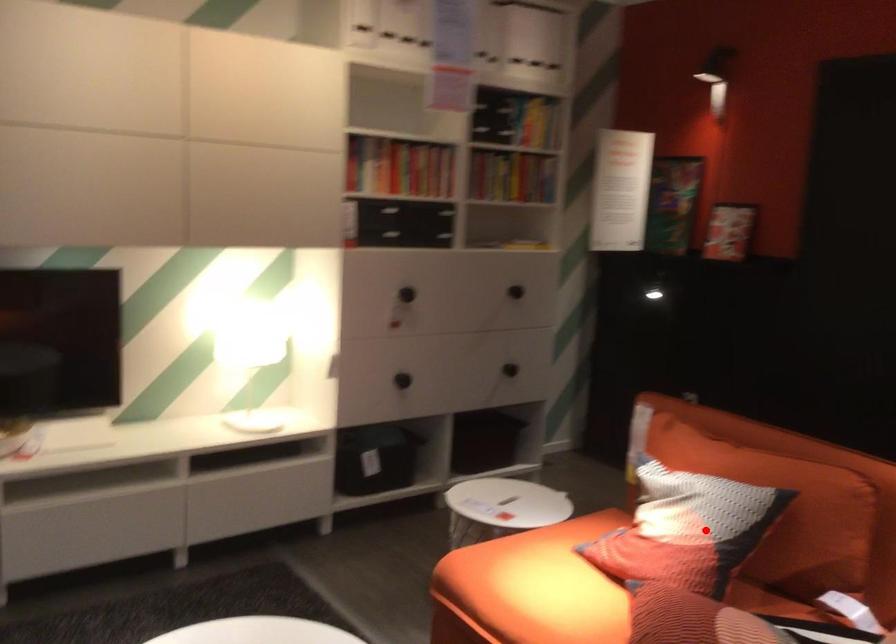
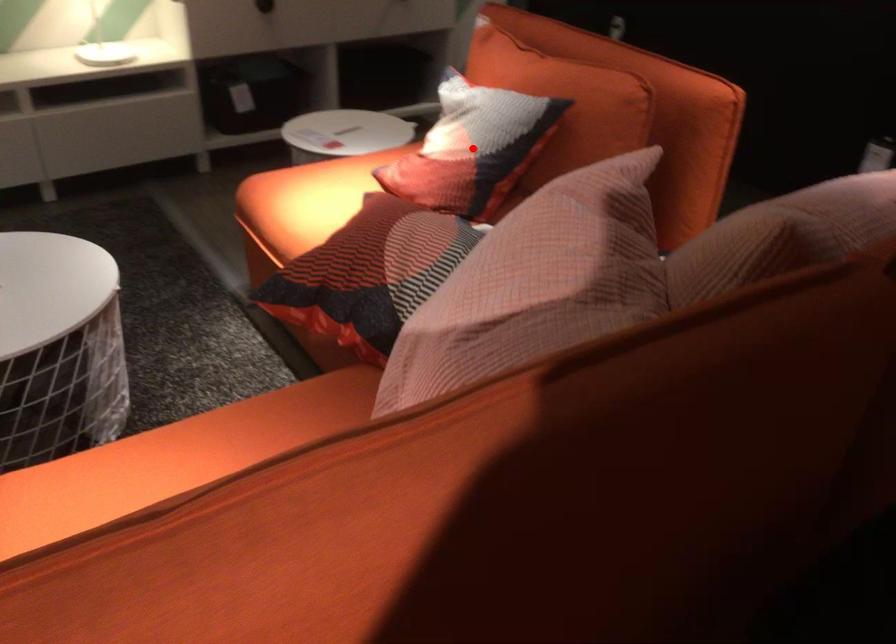
Looking at this image, I am providing you with two images of the same scene from different viewpoints. A red point is marked on the first image and another point is marked on the second image. Are the points marked in image1 and image2 representing the same 3D position?

Yes